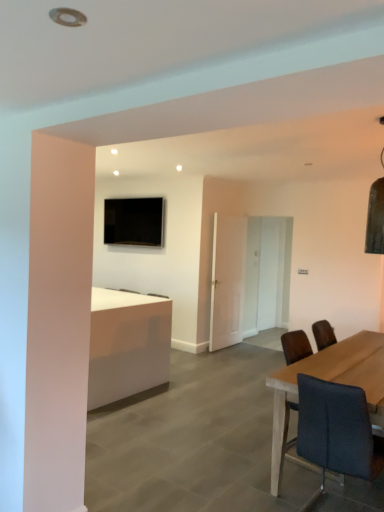
Question: Considering the positions of point click(x=266, y=312) and point click(x=309, y=426), is point click(x=266, y=312) closer or farther from the camera than point click(x=309, y=426)?

Choices:
 (A) closer
 (B) farther

Answer: (B)

Question: Based on their sizes in the image, would you say white glossy door at center, the 1th glass door in the right-to-left sequence, is bigger or smaller than dark gray fabric chair at right?

Choices:
 (A) big
 (B) small

Answer: (A)

Question: Estimate the real-world distances between objects in this image. Which object is closer to the black glossy tv at upper center?

Choices:
 (A) transparent glass door at center, positioned as the second glass door in right-to-left order
 (B) white glossy door at center, which ranks as the second glass door in left-to-right order
 (C) dark gray fabric chair at right
 (D) white glossy desk at center

Answer: (A)

Question: Estimate the real-world distances between objects in this image. Which object is farther from the white glossy door at center, the 1th glass door in the right-to-left sequence?

Choices:
 (A) white glossy desk at center
 (B) dark gray fabric chair at right
 (C) transparent glass door at center, positioned as the second glass door in right-to-left order
 (D) black glossy tv at upper center

Answer: (B)